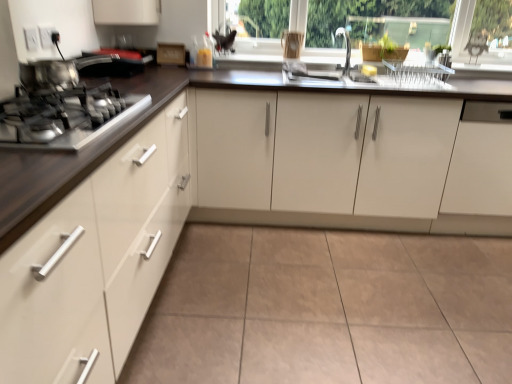
Question: Is white matte cabinet at right, positioned as the 1th cabinetry in right-to-left order, completely or partially inside white glossy cabinets at center, which is the 2th cabinetry from left to right?

Choices:
 (A) yes
 (B) no

Answer: (A)

Question: Is white glossy cabinets at center, which is the 2th cabinetry from left to right, thinner than white matte cabinet at right, which is counted as the third cabinetry, starting from the left?

Choices:
 (A) yes
 (B) no

Answer: (B)

Question: Is white glossy cabinets at center, which is counted as the second cabinetry, starting from the right, at the right side of white matte cabinet at right, positioned as the 1th cabinetry in right-to-left order?

Choices:
 (A) no
 (B) yes

Answer: (A)

Question: From a real-world perspective, is white glossy cabinets at center, which is counted as the second cabinetry, starting from the right, located higher than white matte cabinet at right, positioned as the 1th cabinetry in right-to-left order?

Choices:
 (A) yes
 (B) no

Answer: (B)

Question: Is white glossy cabinets at center, which is counted as the second cabinetry, starting from the right, shorter than white matte cabinet at right, which is counted as the third cabinetry, starting from the left?

Choices:
 (A) yes
 (B) no

Answer: (B)

Question: Can you confirm if white glossy cabinets at center, which is the 2th cabinetry from left to right, is bigger than white matte cabinet at right, which is counted as the third cabinetry, starting from the left?

Choices:
 (A) no
 (B) yes

Answer: (B)

Question: Would you say white matte cabinet at right, positioned as the 1th cabinetry in right-to-left order, is outside transparent glass window frame at upper center?

Choices:
 (A) yes
 (B) no

Answer: (A)

Question: From the image's perspective, is white matte cabinet at right, positioned as the 1th cabinetry in right-to-left order, located above transparent glass window frame at upper center?

Choices:
 (A) yes
 (B) no

Answer: (B)

Question: Could transparent glass window frame at upper center be considered to be inside white matte cabinet at right, positioned as the 1th cabinetry in right-to-left order?

Choices:
 (A) no
 (B) yes

Answer: (A)

Question: Considering the relative sizes of white matte cabinet at right, which is counted as the third cabinetry, starting from the left, and transparent glass window frame at upper center in the image provided, is white matte cabinet at right, which is counted as the third cabinetry, starting from the left, smaller than transparent glass window frame at upper center?

Choices:
 (A) no
 (B) yes

Answer: (A)

Question: Considering the relative positions of white matte cabinet at right, positioned as the 1th cabinetry in right-to-left order, and transparent glass window frame at upper center in the image provided, is white matte cabinet at right, positioned as the 1th cabinetry in right-to-left order, to the right of transparent glass window frame at upper center from the viewer's perspective?

Choices:
 (A) no
 (B) yes

Answer: (B)

Question: Could you tell me if white matte cabinet at right, which is counted as the third cabinetry, starting from the left, is facing transparent glass window frame at upper center?

Choices:
 (A) no
 (B) yes

Answer: (A)

Question: Is white glossy cabinets at center, which is the 2th cabinetry from left to right, oriented away from metallic silver gas stove at left?

Choices:
 (A) no
 (B) yes

Answer: (A)